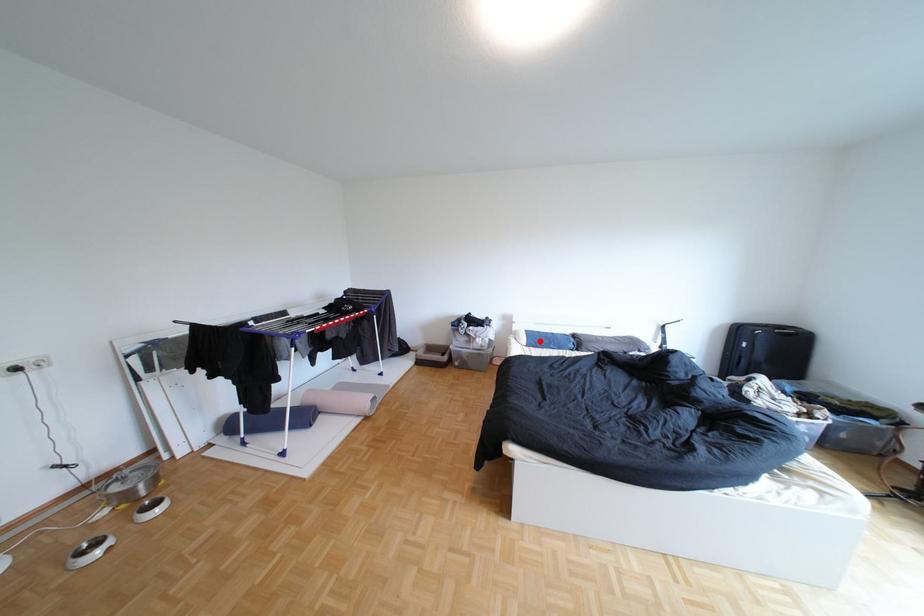
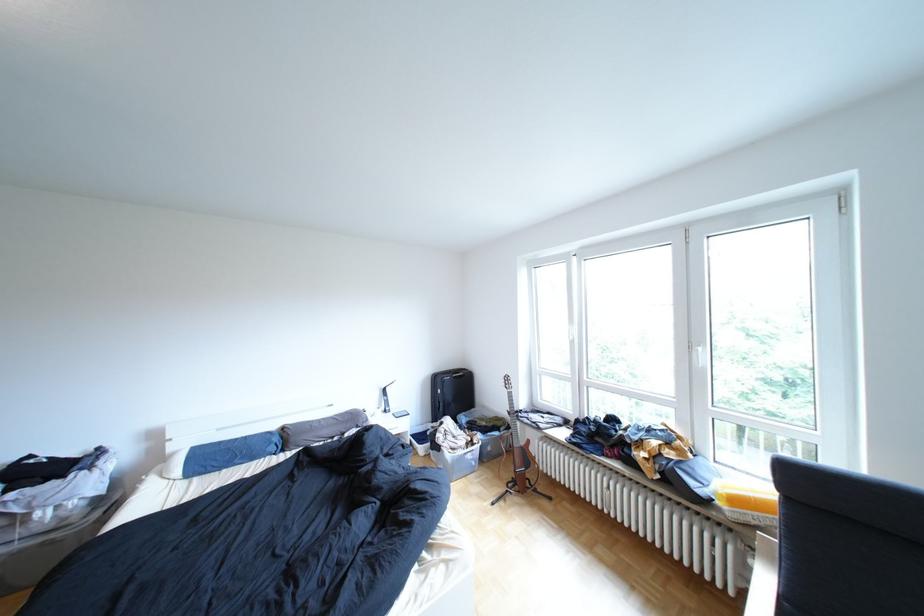
The point at the highlighted location is marked in the first image. Where is the corresponding point in the second image?

(193, 472)